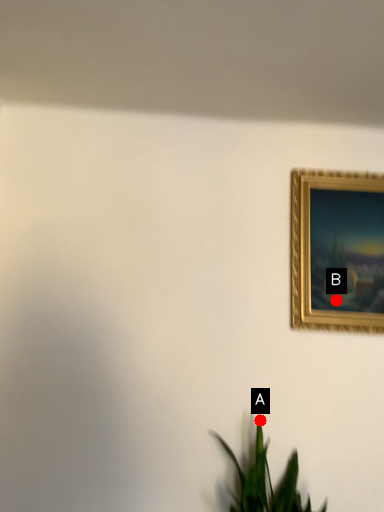
Question: Two points are circled on the image, labeled by A and B beside each circle. Which point is closer to the camera taking this photo?

Choices:
 (A) A is closer
 (B) B is closer

Answer: (A)